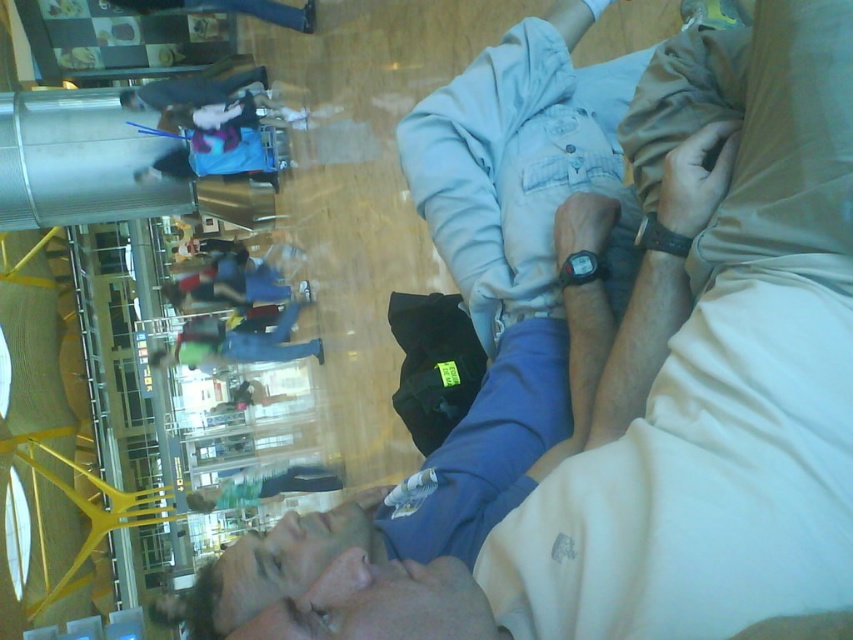
Question: Which point is farther to the camera?

Choices:
 (A) black leather watch at center
 (B) black plastic watch at center
 (C) light blue fabric at center

Answer: (B)

Question: Which object is the closest to the black leather watch at center?

Choices:
 (A) light blue fabric at center
 (B) black plastic watch at center

Answer: (B)

Question: Is the position of light blue fabric at center more distant than that of black plastic watch at center?

Choices:
 (A) no
 (B) yes

Answer: (A)

Question: Which object is the closest to the black leather watch at center?

Choices:
 (A) black plastic watch at center
 (B) light blue fabric at center

Answer: (A)

Question: Is black leather watch at center in front of black plastic watch at center?

Choices:
 (A) yes
 (B) no

Answer: (A)

Question: Can you confirm if light blue fabric at center is thinner than black leather watch at center?

Choices:
 (A) yes
 (B) no

Answer: (B)